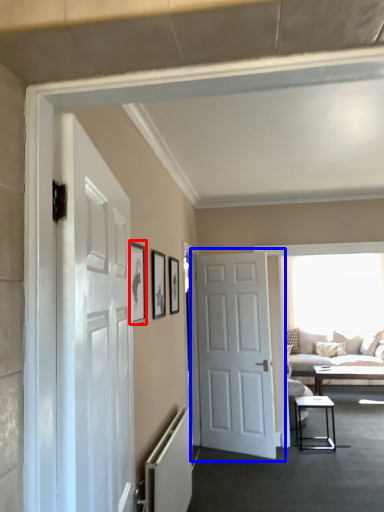
Question: Which object appears closest to the camera in this image, picture frame (highlighted by a red box) or door (highlighted by a blue box)?

Choices:
 (A) picture frame
 (B) door

Answer: (A)